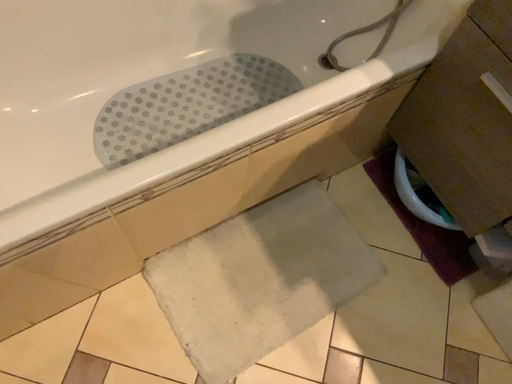
Where is `vacant space positioned to the left of beige matte tile at lower right`? vacant space positioned to the left of beige matte tile at lower right is located at coordinates (437, 311).